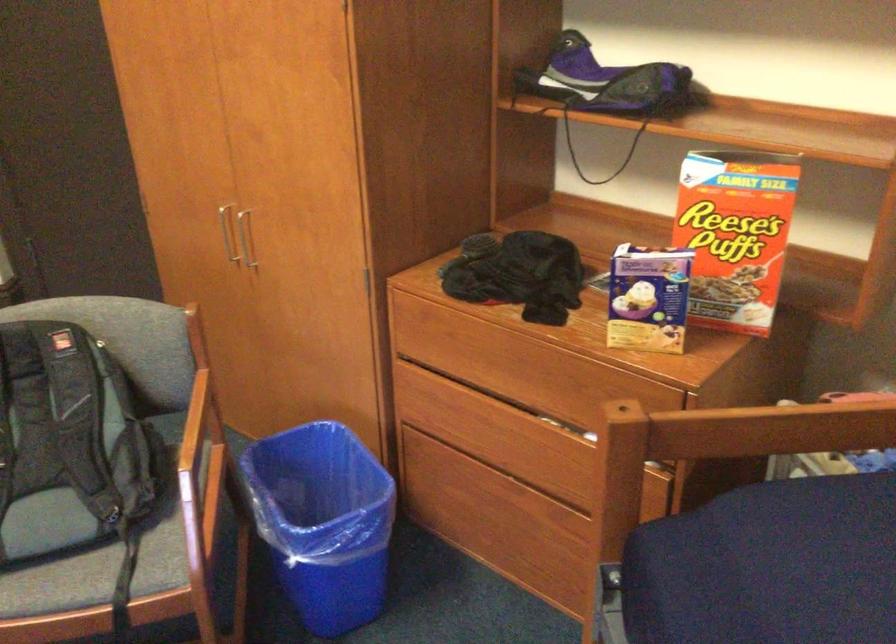
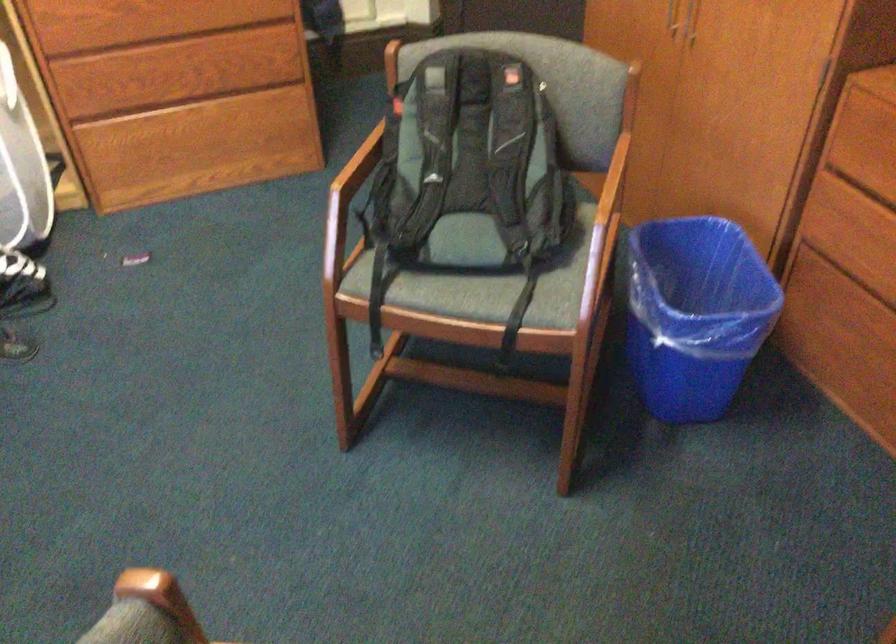
Locate, in the second image, the point that corresponds to pixel 429 460 in the first image.

(828, 285)